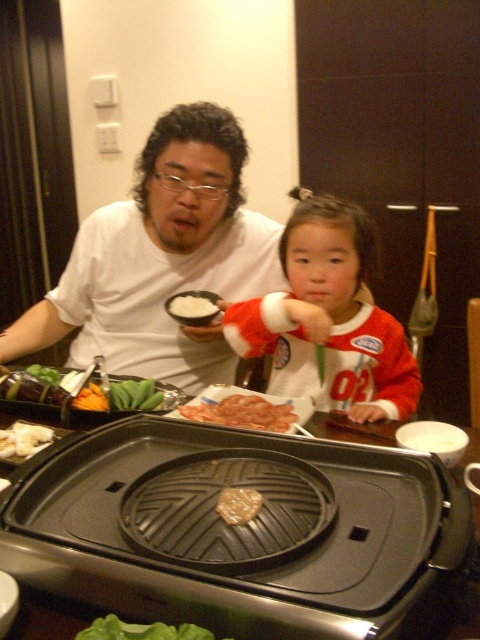
Between green leafy vegetable at lower left and white matte rice at center, which one has more height?

Standing taller between the two is green leafy vegetable at lower left.

This screenshot has height=640, width=480. What do you see at coordinates (141, 630) in the screenshot?
I see `green leafy vegetable at lower left` at bounding box center [141, 630].

Locate an element on the screen. The image size is (480, 640). green leafy vegetable at lower left is located at coordinates (141, 630).

Is green leafy vegetables at center positioned behind green leafy vegetable at lower left?

Yes, green leafy vegetables at center is further from the viewer.

Which is behind, point (131, 390) or point (183, 627)?

The point (131, 390) is more distant.

The width and height of the screenshot is (480, 640). In order to click on green leafy vegetables at center in this screenshot , I will do [x=81, y=392].

Does white fluffy rice at upper left appear on the right side of white matte rice at center?

Incorrect, white fluffy rice at upper left is not on the right side of white matte rice at center.

Does white fluffy rice at upper left have a larger size compared to white matte rice at center?

No, white fluffy rice at upper left is not bigger than white matte rice at center.

Which is behind, point (32, 432) or point (192, 300)?

The point (192, 300) is behind.

Find the location of a particular element. Image resolution: width=480 pixels, height=640 pixels. white fluffy rice at upper left is located at coordinates (24, 440).